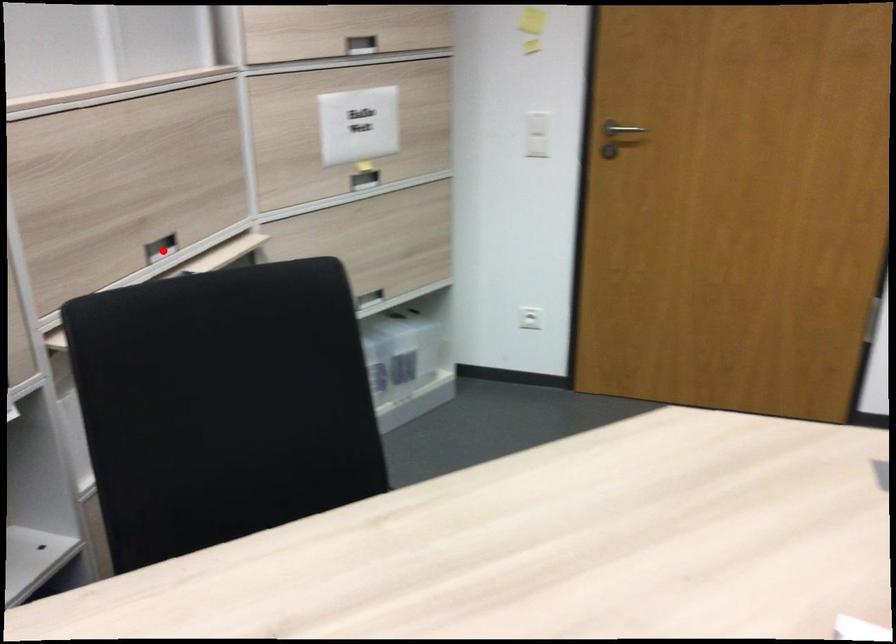
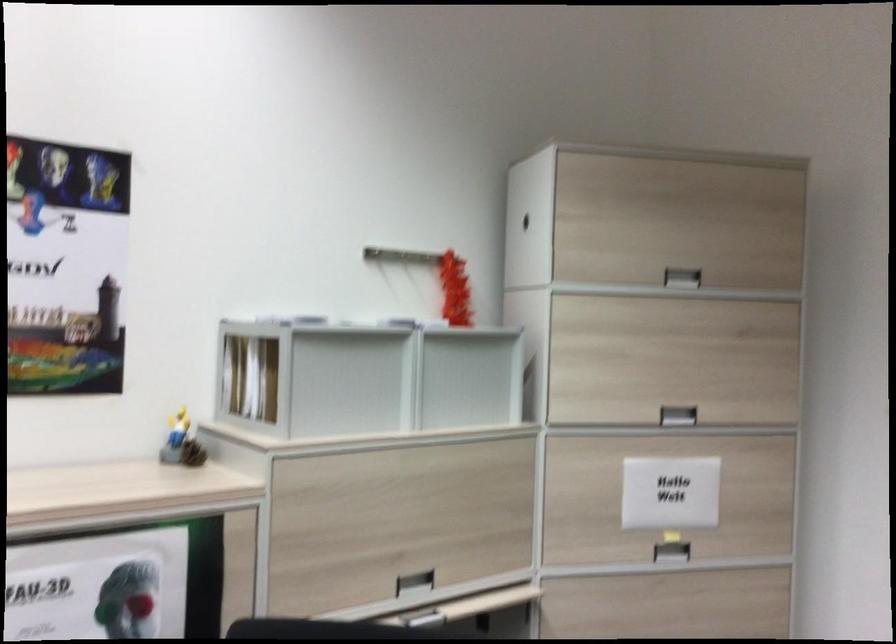
Find the pixel in the second image that matches the highlighted location in the first image.

(415, 583)